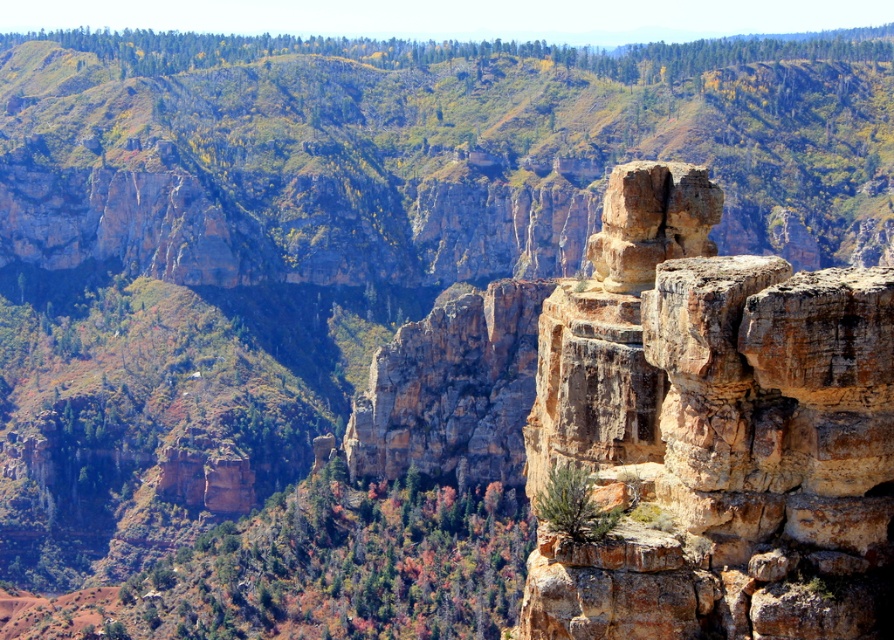
You are a hiker planning to climb both the rustic stone cliff at center and the rusty brown rock at right. Based on the image, which of the two would require more stamina due to its height?

The rustic stone cliff at center requires more stamina because it has a greater height compared to the rusty brown rock at right.

You are a hiker planning to cross the canyon. You have two options for paths leading to the bottom of the canyon. One path is along the rustic stone cliff at center, and the other is near the rusty brown rock at right. Which path would require you to walk a greater distance horizontally?

The rustic stone cliff at center might be wider than rusty brown rock at right, so the path along the rustic stone cliff at center would likely require walking a greater horizontal distance.